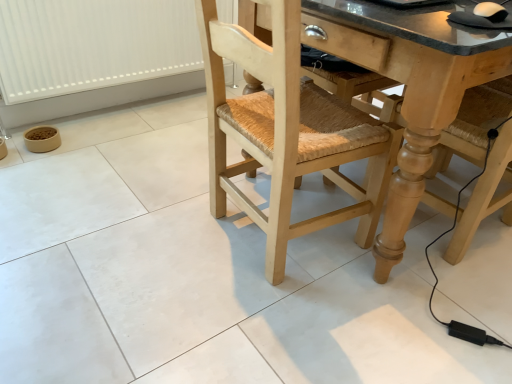
You are a GUI agent. You are given a task and a screenshot of the screen. Output one action in this format:
    pyautogui.click(x=<x>, y=<y>)
    Task: Click on the vacant area that is in front of white plastic radiator at lower left
    
    Given the screenshot: What is the action you would take?
    pyautogui.click(x=106, y=167)